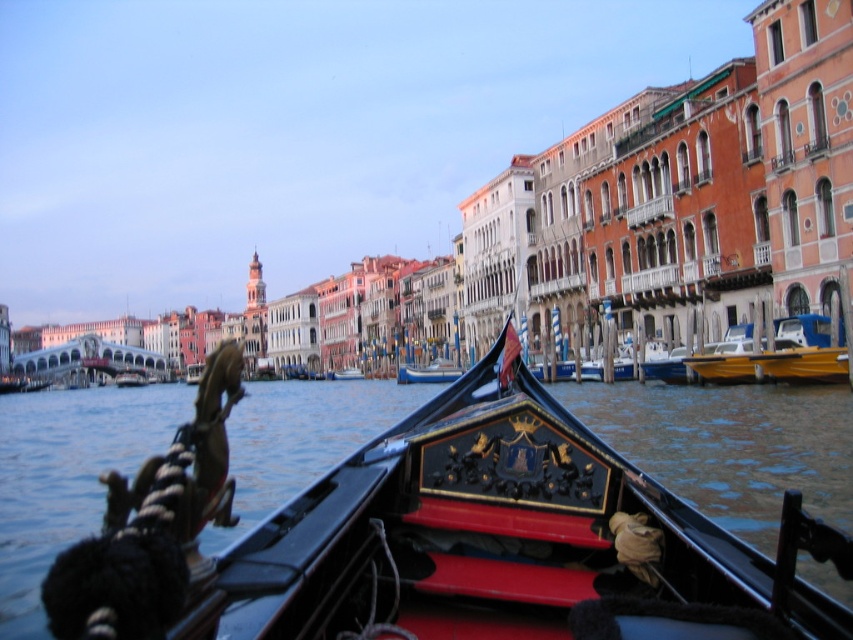
Based on the photo, you are a tourist standing on the bridge overlooking the canal. You want to take a photo of both the glossy water at center and the wooden gondola at center. Given that your camera has a maximum zoom range of 100 feet, will you be able to capture both objects in a single frame without moving closer?

The distance between the glossy water at center and the wooden gondola at center is 121.11 feet, which exceeds the camera maximum zoom range of 100 feet. Therefore, you cannot capture both objects in a single frame without moving closer.

You are standing on the right side of the canal and want to see the glossy water at center. In which direction should you look relative to your position?

The glossy water at center is located at point (732, 444), so you should look towards the center of the canal from your position on the right side.

You are standing on a bridge overlooking the canal and want to take a photo of the wooden gondola at center and the glossy water at center. Which object should you focus on first if you want to capture both in a single shot without moving the camera?

You should focus on the wooden gondola at center first because the glossy water at center is located below it, so adjusting focus to include both would require ensuring the gondola is in the upper part of the frame and the water below it remains in focus range.